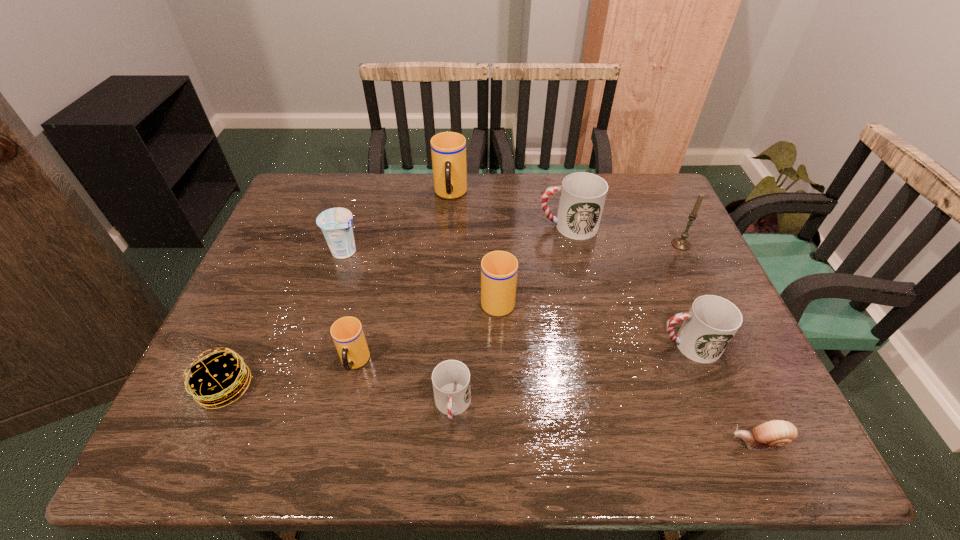
Find the location of a particular element. This screenshot has width=960, height=540. cup that is at the right edge is located at coordinates (712, 321).

Identify the location of escargot positioned at the right edge. The width and height of the screenshot is (960, 540). point(776,433).

Locate an element on the screen. Image resolution: width=960 pixels, height=540 pixels. object that is at the near right corner is located at coordinates (776, 433).

I want to click on vacant space at the far edge of the desktop, so click(x=393, y=210).

In the image, there is a desktop. Identify the location of vacant space at the near edge. (432, 444).

Locate an element on the screen. This screenshot has width=960, height=540. free space at the left edge of the desktop is located at coordinates (251, 361).

You are a GUI agent. You are given a task and a screenshot of the screen. Output one action in this format:
    pyautogui.click(x=<x>, y=<y>)
    Task: Click on the free spot at the right edge of the desktop
    The image size is (960, 540).
    Given the screenshot: What is the action you would take?
    pyautogui.click(x=666, y=298)

Image resolution: width=960 pixels, height=540 pixels. I want to click on vacant space at the far right corner of the desktop, so click(638, 175).

This screenshot has width=960, height=540. In the image, there is a desktop. In order to click on vacant space at the near right corner in this screenshot , I will do `click(727, 442)`.

The width and height of the screenshot is (960, 540). What are the coordinates of `unoccupied position between the nearest red cup and the second biggest red cup` in the screenshot? It's located at (570, 375).